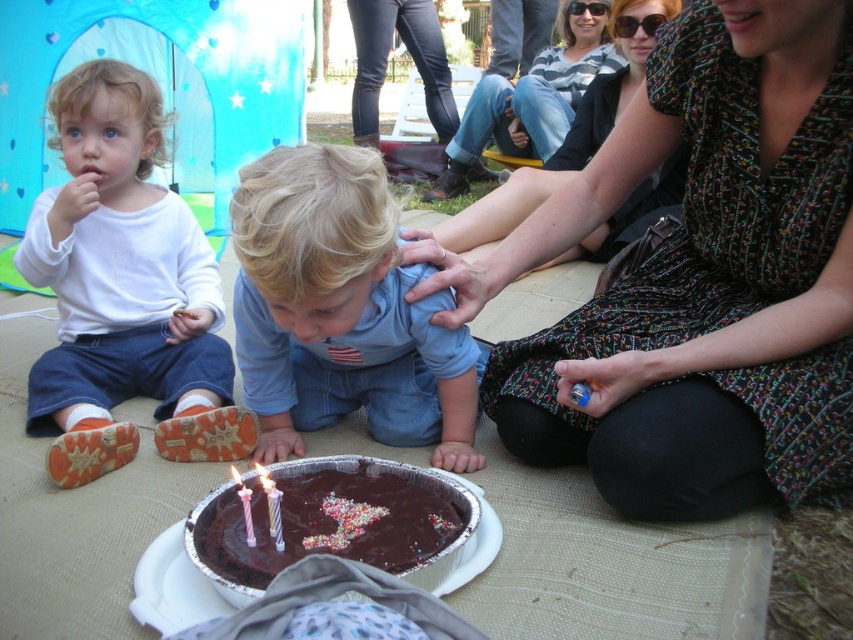
You are a guest at the birthday party and want to blow out the candles on the chocolatesmoothcake at lower center. The pastel striped candle at center is in the way. Can you reach the cake without moving the candle?

The chocolatesmoothcake at lower center is located below the pastel striped candle at center, so you can reach the cake by moving your hand under the candle to blow out the candles without needing to move it.

Based on the photo, you are a guest at the birthday party and want to take a photo of the chocolatesmoothcake at lower center and the translucent plastic candle at center. Which object should you focus on first if you want to include both in the frame without moving the camera?

The chocolatesmoothcake at lower center is larger in size than the translucent plastic candle at center, so you should focus on the chocolatesmoothcake at lower center first to ensure it fits properly in the frame before adjusting for the smaller candle.